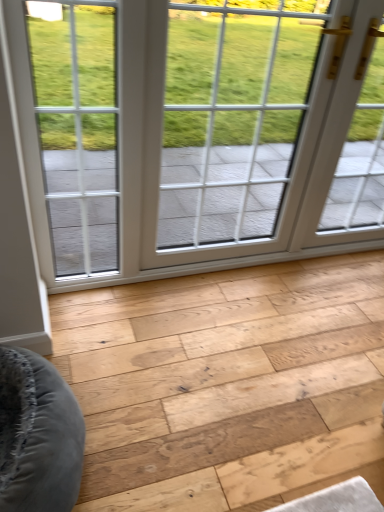
Question: Are natural wood plank at center and white glass window at center beside each other?

Choices:
 (A) yes
 (B) no

Answer: (B)

Question: Does natural wood plank at center appear on the left side of white glass window at center?

Choices:
 (A) no
 (B) yes

Answer: (A)

Question: Can you confirm if natural wood plank at center is wider than white glass window at center?

Choices:
 (A) no
 (B) yes

Answer: (B)

Question: Is white glass window at center surrounded by natural wood plank at center?

Choices:
 (A) yes
 (B) no

Answer: (B)

Question: Is natural wood plank at center thinner than white glass window at center?

Choices:
 (A) no
 (B) yes

Answer: (A)

Question: Could you tell me if natural wood plank at center is facing white glass window at center?

Choices:
 (A) yes
 (B) no

Answer: (B)

Question: Is white glass window at center further to camera compared to natural wood plank at center?

Choices:
 (A) yes
 (B) no

Answer: (A)

Question: Does white glass window at center lie in front of natural wood plank at center?

Choices:
 (A) no
 (B) yes

Answer: (A)

Question: Can you confirm if white glass window at center is positioned to the left of natural wood plank at center?

Choices:
 (A) no
 (B) yes

Answer: (B)

Question: Considering the relative sizes of white glass window at center and natural wood plank at center in the image provided, is white glass window at center thinner than natural wood plank at center?

Choices:
 (A) no
 (B) yes

Answer: (B)

Question: Is white glass window at center wider than natural wood plank at center?

Choices:
 (A) yes
 (B) no

Answer: (B)

Question: Is white glass window at center aimed at natural wood plank at center?

Choices:
 (A) yes
 (B) no

Answer: (A)

Question: In the image, is natural wood plank at center on the left side or the right side of white glass window at center?

Choices:
 (A) right
 (B) left

Answer: (A)